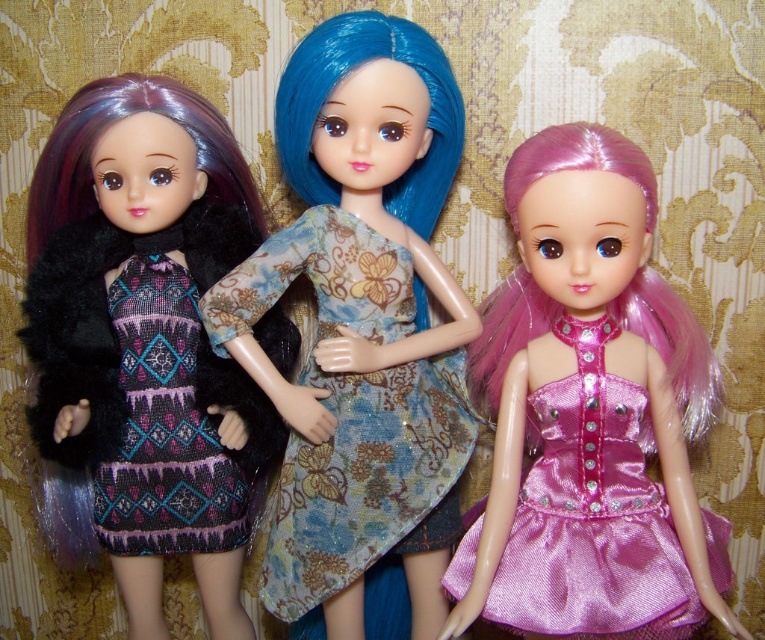
You are a fashion designer trying to decide which doll to feature in your upcoming ad campaign. You need to know which item has a greater width to ensure proper lighting in the photoshoot. Which has a larger width between the shiny black fur coat at left and the patterned fabric dress at left?

The shiny black fur coat at left has a larger width than the patterned fabric dress at left.

You are a fashion designer examining the dolls in the image. You need to determine which item of clothing is larger between the shiny black fur coat at left and the patterned fabric dress at left. Based on the scene, which one is bigger?

The shiny black fur coat at left is bigger than the patterned fabric dress at left.